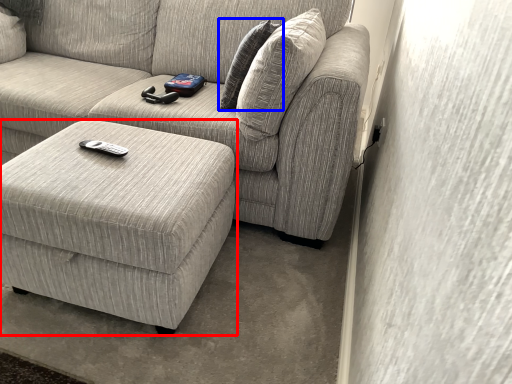
Question: Which point is further to the camera, table (highlighted by a red box) or pillow (highlighted by a blue box)?

Choices:
 (A) table
 (B) pillow

Answer: (B)